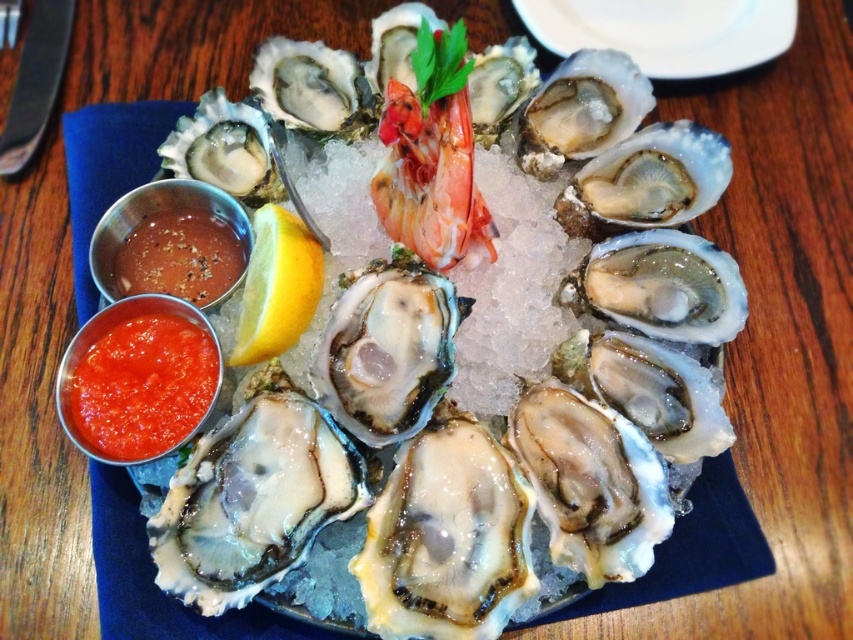
Question: Which object appears farthest from the camera in this image?

Choices:
 (A) white shell oyster at center
 (B) smooth tomato sauce at lower left
 (C) yellow matte lemon at center
 (D) smokey brown paste at lower left

Answer: (A)

Question: Is white shell oyster at center thinner than smokey brown paste at lower left?

Choices:
 (A) no
 (B) yes

Answer: (A)

Question: Which of the following is the farthest from the observer?

Choices:
 (A) (744, 36)
 (B) (199, 397)
 (C) (318, 252)
 (D) (126, 266)

Answer: (A)

Question: Does white shell oyster at center lie in front of smokey brown paste at lower left?

Choices:
 (A) yes
 (B) no

Answer: (B)

Question: Can you confirm if white shell oyster at center is positioned below yellow matte lemon at center?

Choices:
 (A) no
 (B) yes

Answer: (A)

Question: Which object is the closest to the smokey brown paste at lower left?

Choices:
 (A) smooth tomato sauce at lower left
 (B) yellow matte lemon at center

Answer: (B)